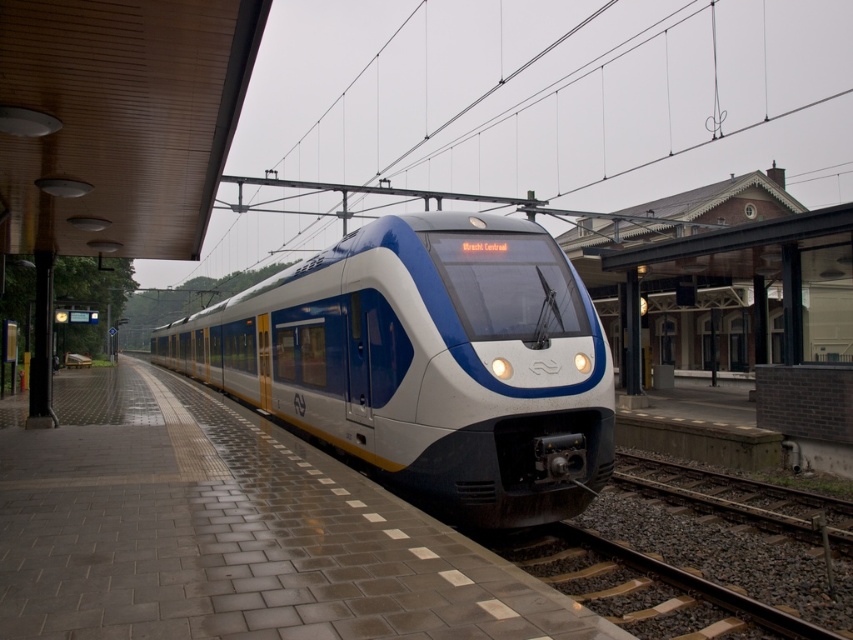
Question: Is brick platform at center below matte white train at center?

Choices:
 (A) yes
 (B) no

Answer: (A)

Question: Does brick platform at center appear on the left side of matte white train at center?

Choices:
 (A) no
 (B) yes

Answer: (A)

Question: Among these objects, which one is nearest to the camera?

Choices:
 (A) brick platform at center
 (B) matte white train at center

Answer: (A)

Question: Can you confirm if brick platform at center is positioned above matte white train at center?

Choices:
 (A) yes
 (B) no

Answer: (B)

Question: Which point appears closest to the camera in this image?

Choices:
 (A) pos(274,602)
 (B) pos(408,355)

Answer: (A)